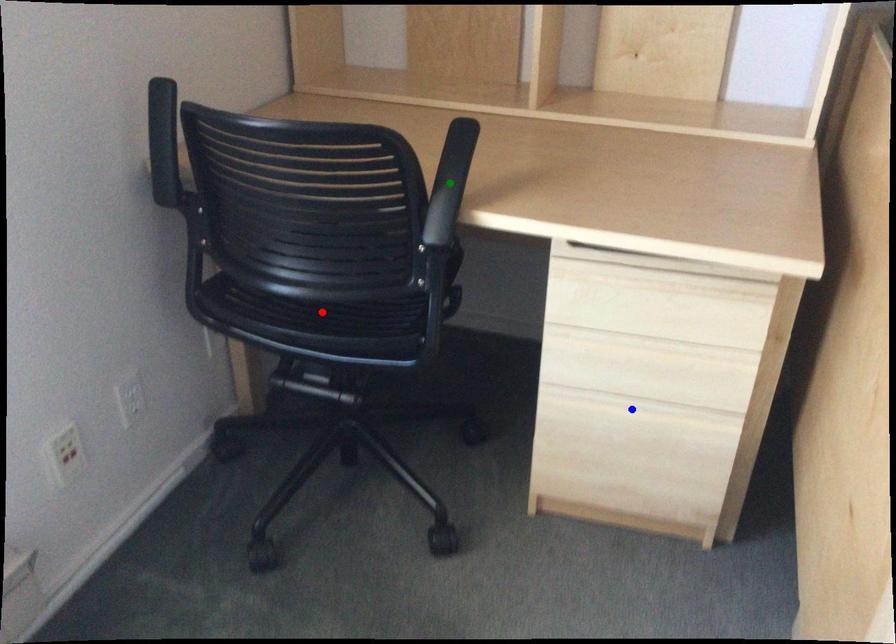
Order these from farthest to nearest:
blue point
green point
red point

1. blue point
2. red point
3. green point